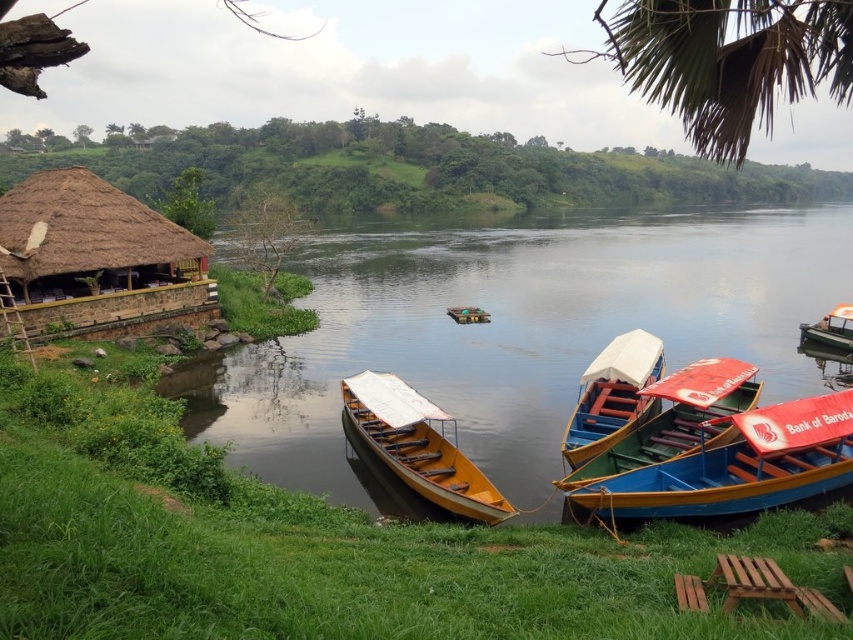
You are standing at the riverside and see the blue wooden boat at lower right and the green plastic boat at right. Which boat is closer to the water surface?

The blue wooden boat at lower right is closer to the water surface because it is positioned under the green plastic boat at right.

You are standing at the thatched straw hut at left and want to throw a stone to the opposite bank of the river. The stone can travel 80 feet. Will it reach the opposite bank?

The distance between the thatched straw hut at left and the opposite bank is 80.80 feet. Since the stone can travel 80 feet, it will fall short by 0.80 feet and won

You are a fisherman who needs to choose between the yellow wood boat at center and the red plastic boat at lower right for a trip across the river. Considering their widths, which boat would allow for more stable movement in slightly rough waters?

The red plastic boat at lower right is wider than the yellow wood boat at center, making it more stable in rough waters due to its increased width providing better balance.